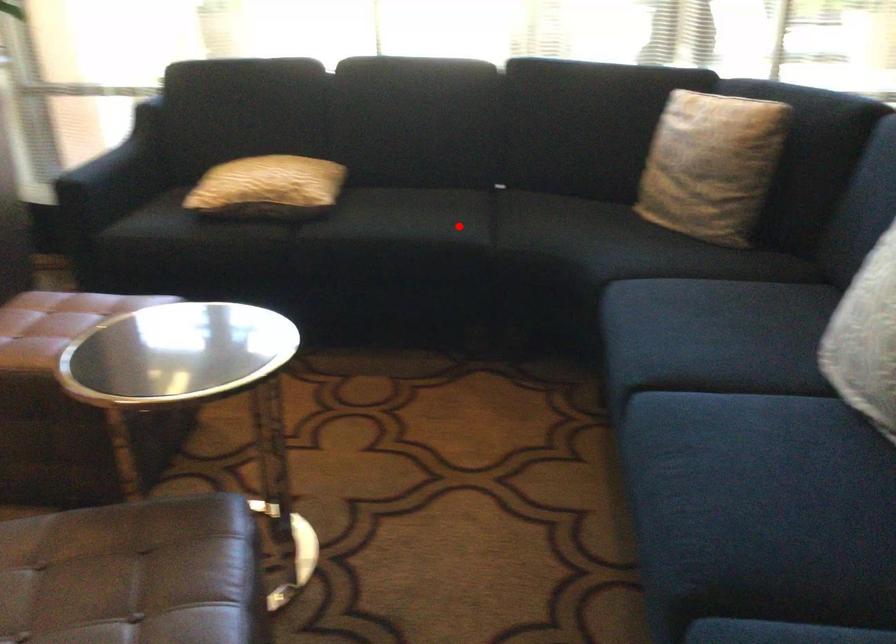
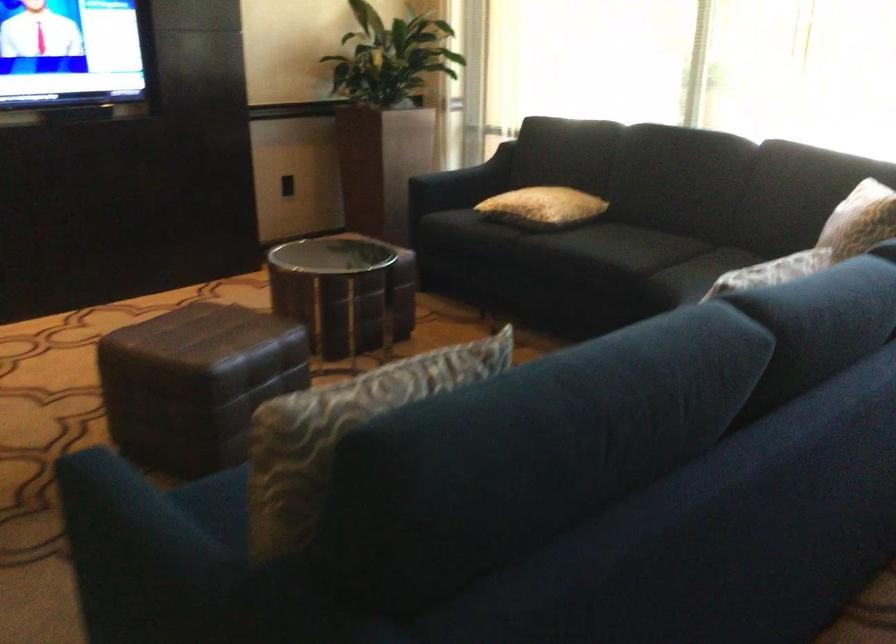
In the second image, find the point that corresponds to the highlighted location in the first image.

(626, 254)